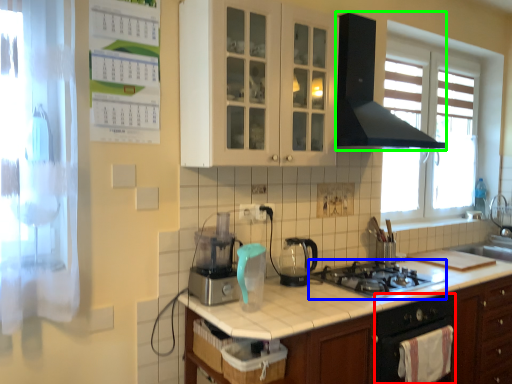
Question: Considering the real-world distances, which object is closest to oven (highlighted by a red box)? gas stove (highlighted by a blue box) or home appliance (highlighted by a green box).

Choices:
 (A) gas stove
 (B) home appliance

Answer: (A)